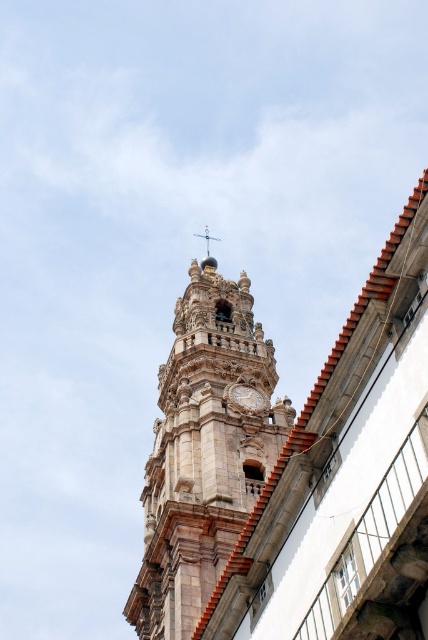
You are an architect analyzing the historic building. You notice the stone clock tower at center and the gold textured dome at upper center. Which of these two elements has a larger size according to the image?

The stone clock tower at center is bigger than the gold textured dome at upper center, so the stone clock tower at center has a larger size.

You are an architect planning to install a new lighting system between the stone clock tower at center and the gold textured dome at upper center. The system requires a minimum distance of 30 meters between fixtures to ensure proper coverage. Based on the scene, will the distance between these two structures allow for the installation of the lighting system as planned?

The stone clock tower at center and gold textured dome at upper center are 32.63 meters apart, which exceeds the required 30 meters. Therefore, the lighting system can be installed as planned between them.

You are standing in front of the historic building and notice two objects of interest. The first is the stone clock tower at center, and the second is the white stone clock at upper center. From your vantage point, which of these two objects is positioned higher up in the image?

The white stone clock at upper center is positioned higher up in the image than the stone clock tower at center.